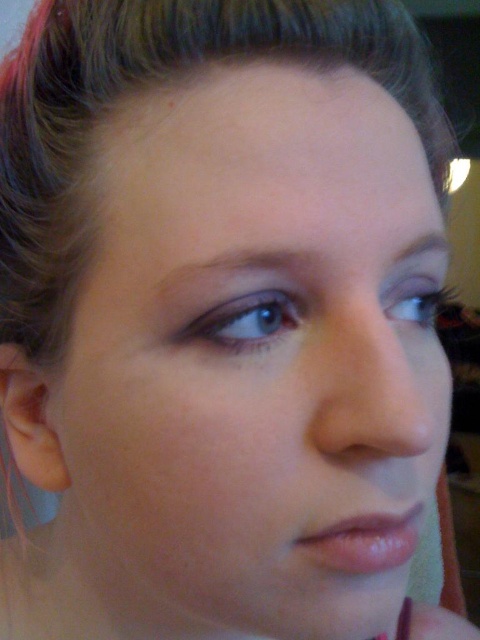
Based on the scene description, which object is smaller in size between the smooth skin face at center and the brown shiny hair at upper center?

The smooth skin face at center is smaller in size compared to the brown shiny hair at upper center according to the description.

Looking at this image, based on the scene, which object has a smaller width between the smooth skin face at center and the brown shiny hair at upper center?

The smooth skin face at center has a lesser width compared to the brown shiny hair at upper center.